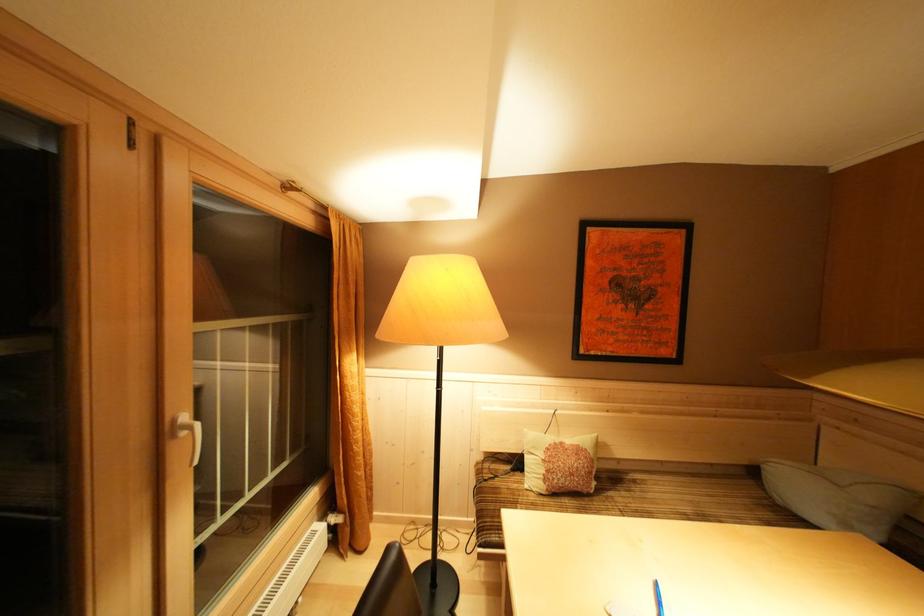
Describe the element at coordinates (688, 493) in the screenshot. I see `a sofa sitting surface` at that location.